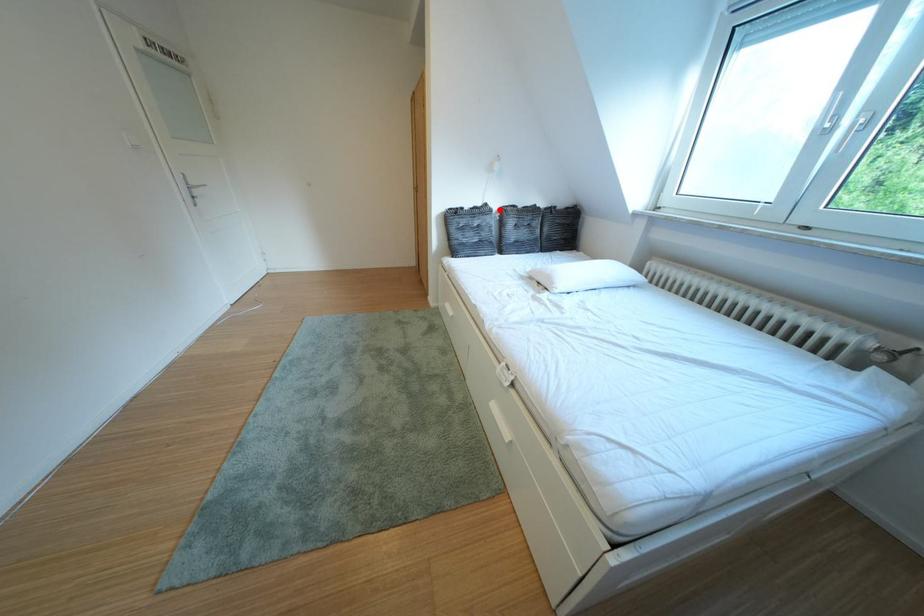
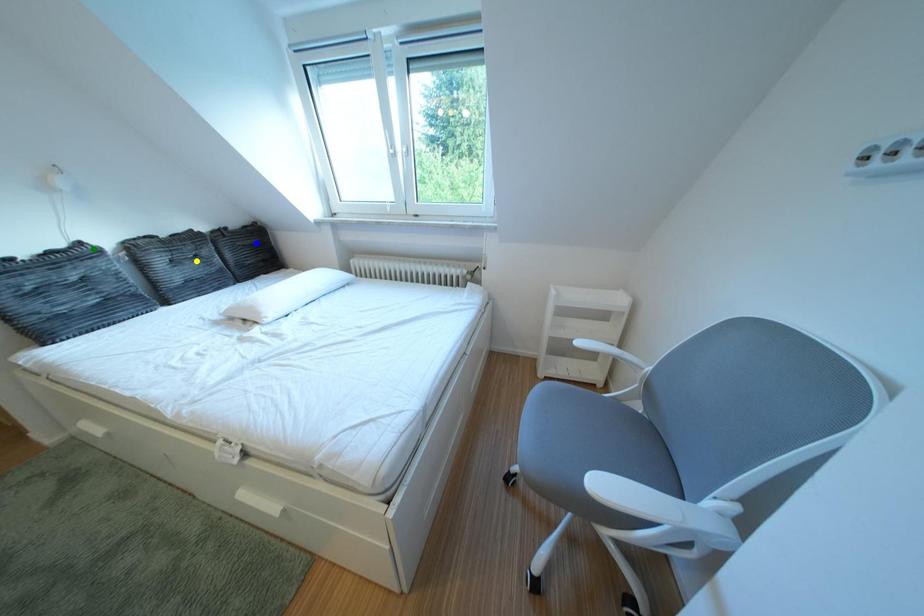
Question: I am providing you with two images of the same scene from different viewpoints. A red point is marked on the first image. You are given multiple points on the second image. Which point in image 2 is actually the same real-world point as the red point in image 1?

Choices:
 (A) blue point
 (B) yellow point
 (C) green point

Answer: (C)